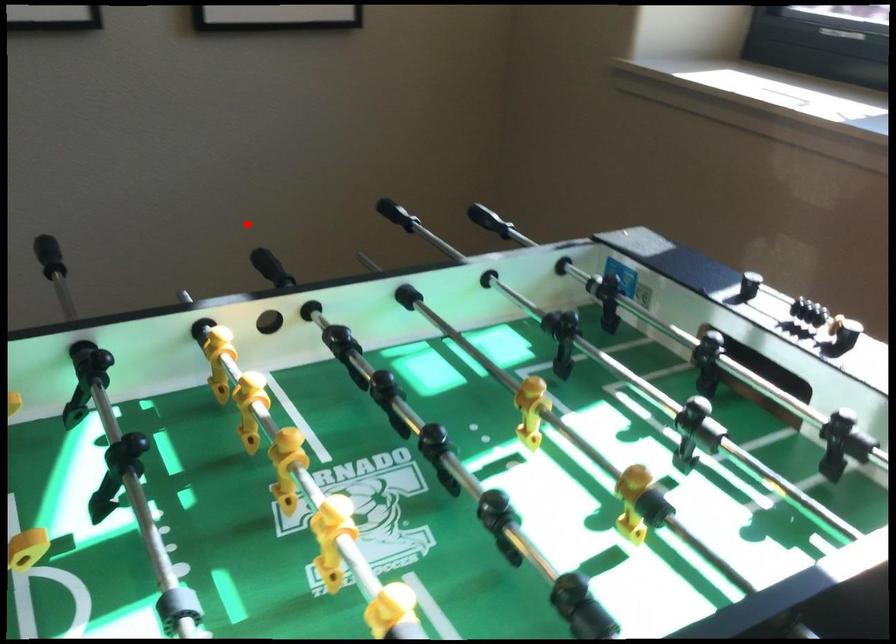
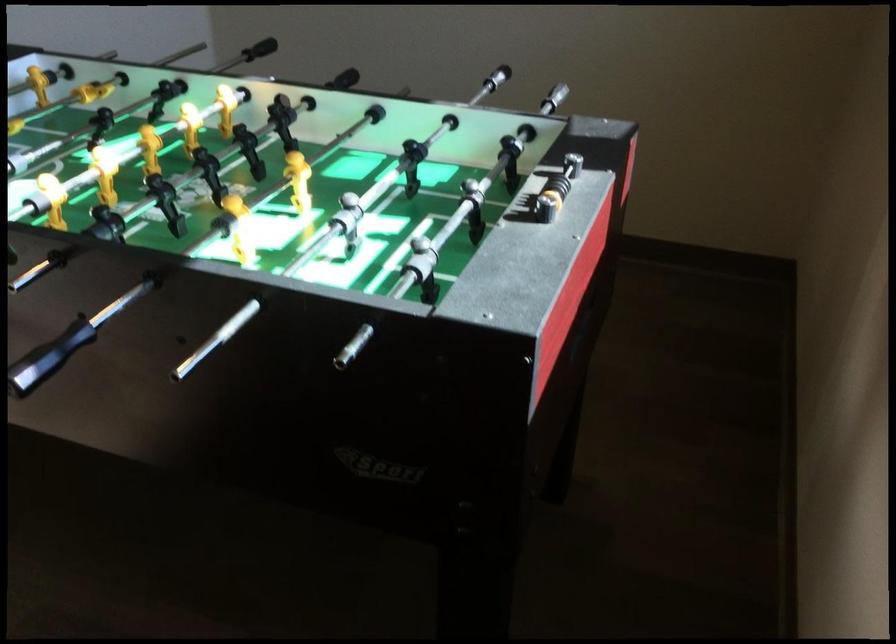
Where in the second image is the point corresponding to the highlighted location from the first image?

(554, 98)